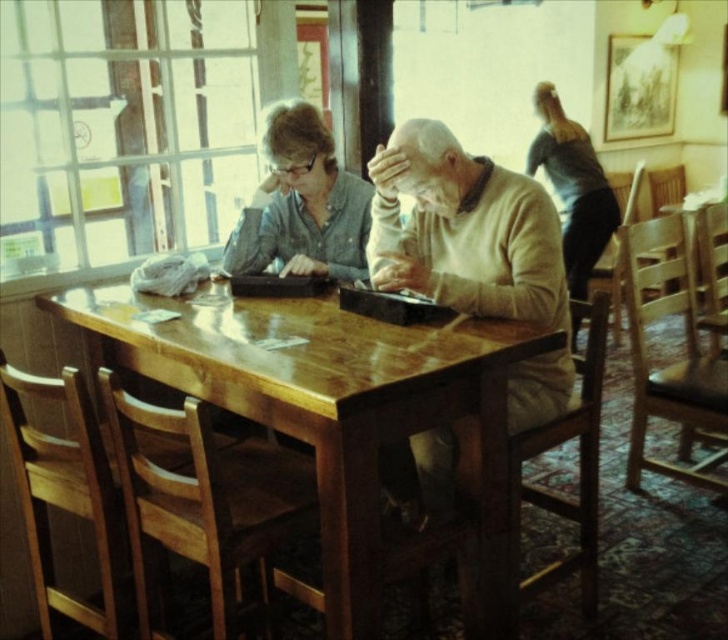
Is point (328, 451) closer to camera compared to point (494, 221)?

Yes, point (328, 451) is in front of point (494, 221).

Between glossy wood table at center and light beige sweater at center, which one has less height?

With less height is glossy wood table at center.

Is point (360, 502) in front of point (443, 250)?

Yes.

Where is `glossy wood table at center`? This screenshot has height=640, width=728. glossy wood table at center is located at coordinates (340, 413).

This screenshot has width=728, height=640. What do you see at coordinates (301, 204) in the screenshot?
I see `matte gray sweater at center` at bounding box center [301, 204].

Does point (344, 257) come behind point (542, 120)?

No.

Which is behind, point (282, 113) or point (563, 161)?

The point (563, 161) is behind.

Where is `matte gray sweater at center`? This screenshot has height=640, width=728. matte gray sweater at center is located at coordinates (301, 204).

Who is more forward, (478,291) or (277,157)?

Point (478,291)

Between light beige sweater at center and matte gray sweater at center, which one has more height?

Standing taller between the two is light beige sweater at center.

Is point (530, 420) positioned behind point (316, 164)?

No, (530, 420) is in front of (316, 164).

At what (x,y) coordinates should I click in order to perform the action: click on light beige sweater at center. Please return your answer as a coordinate pair (x, y). The height and width of the screenshot is (640, 728). Looking at the image, I should click on (464, 230).